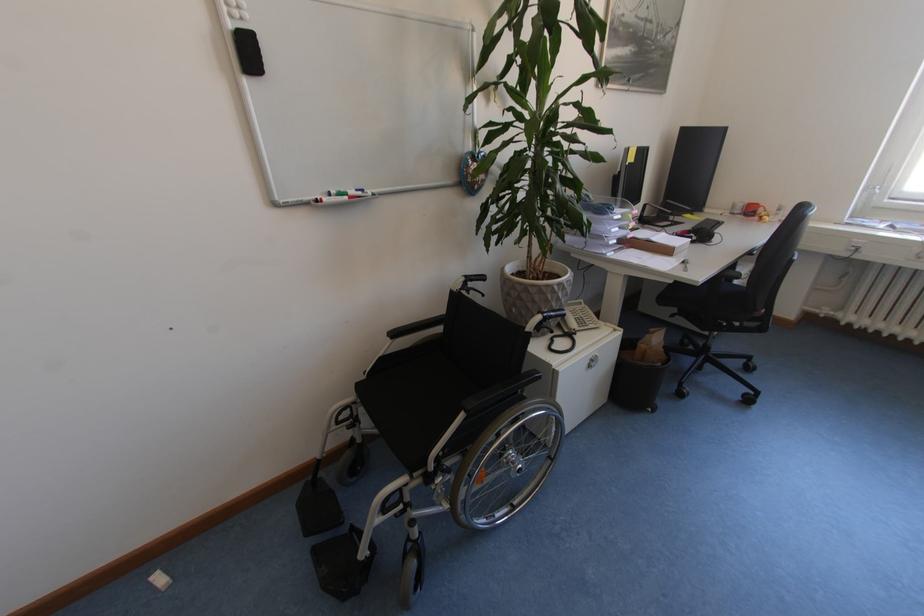
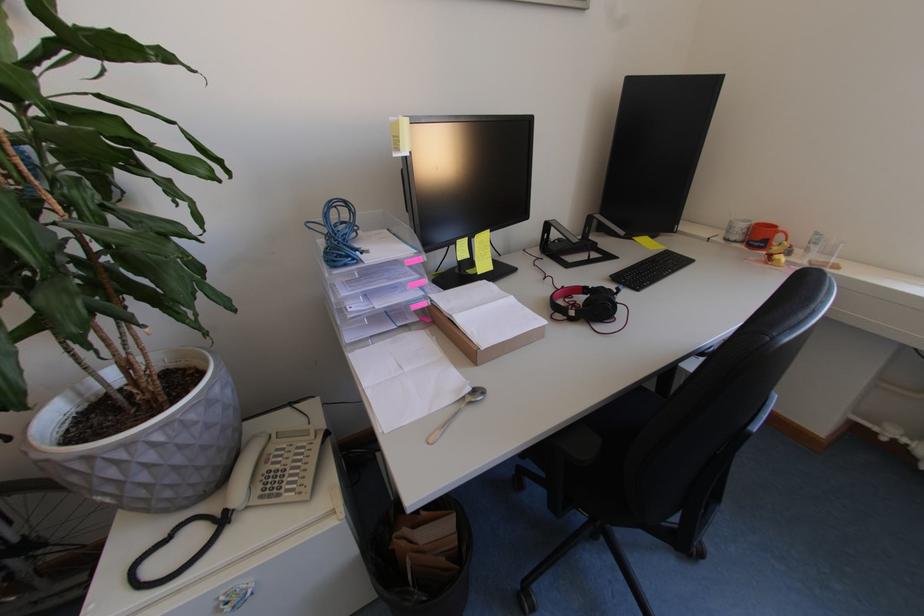
Find the pixel in the second image that matches (x=768, y=209) in the first image.

(786, 238)